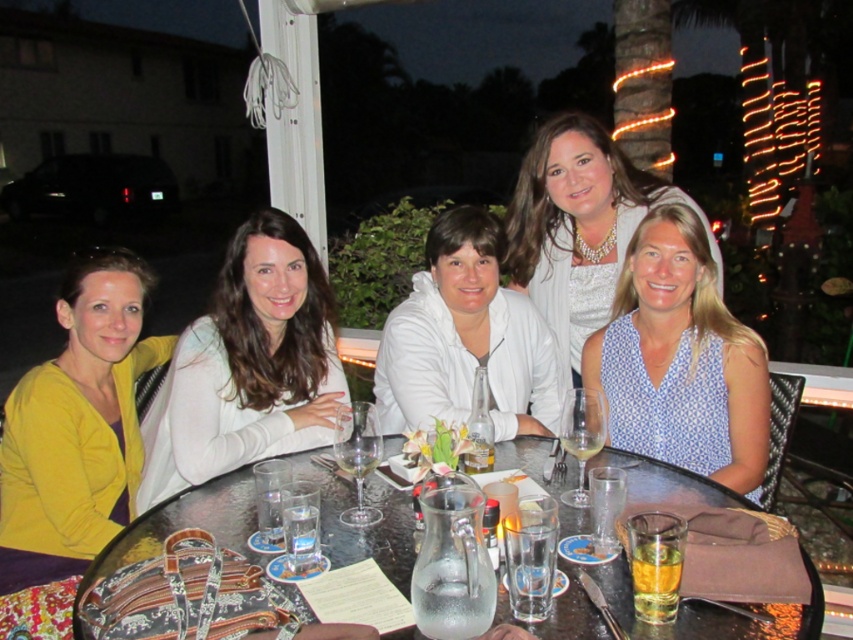
You are a photographer setting up for a group photo. You have a white matte jacket at center and a clear glass water at center in the scene. Which object should you adjust if you want to ensure there is enough space between the two items for a balanced composition?

The white matte jacket at center has a larger width than the clear glass water at center, so you should adjust the position of the white matte jacket at center to create more space between them for a balanced composition.

You are a photographer trying to capture a closeup of the white pearl necklace at upper center. Given that your camera lens has a minimum focusing distance of 6 feet, will you be able to take the closeup without moving closer?

The white pearl necklace at upper center is 7.24 feet away from the camera, which is beyond the lens minimum focusing distance of 6 feet. Therefore, you can take the closeup without moving closer.

You are at a social event and want to grab your drink. You see the white matte jacket at center and the clear glass water at center. Which object is closer to you?

The white matte jacket at center is closer to you because the clear glass water at center is behind it.